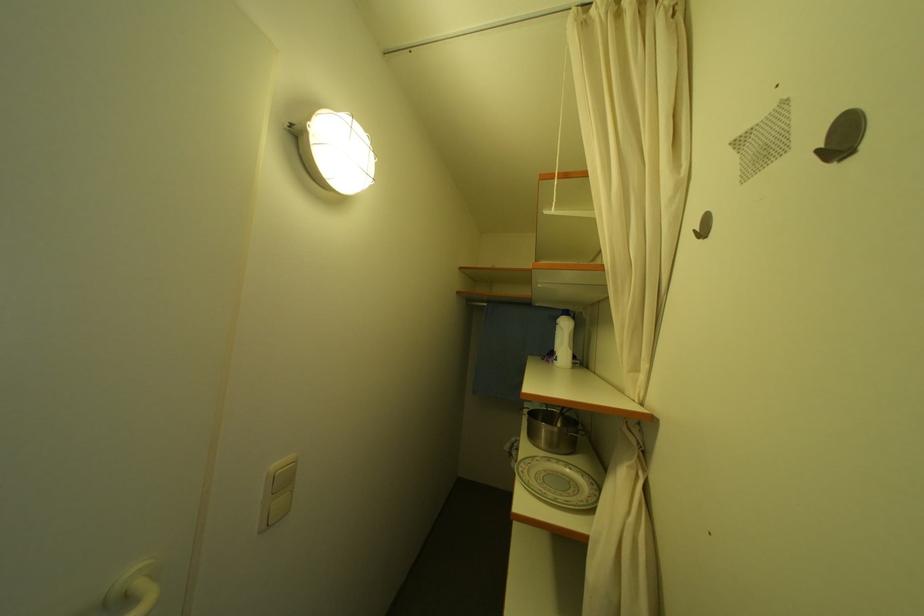
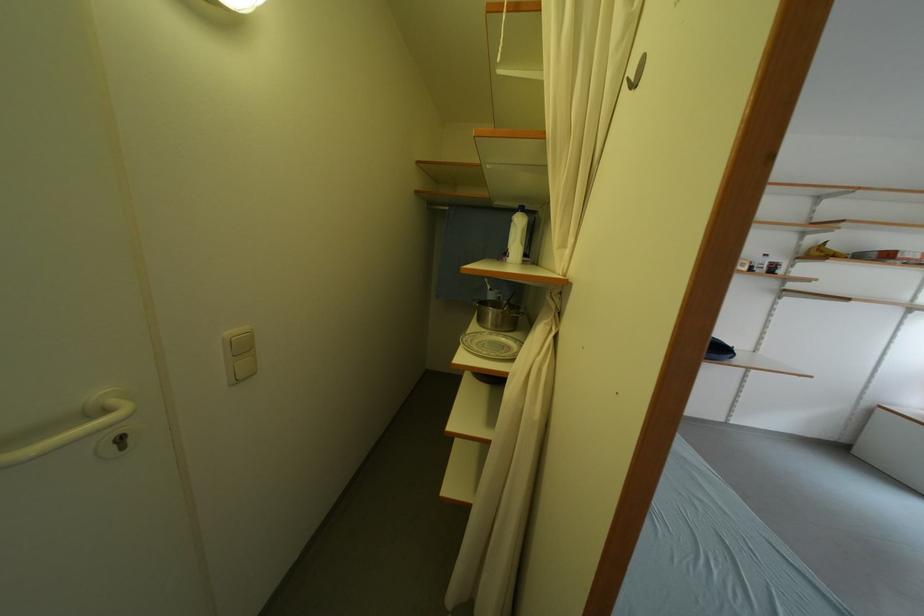
Question: The images are taken continuously from a first-person perspective. In which direction is your viewpoint rotating?

Choices:
 (A) Left
 (B) Right
 (C) Up
 (D) Down

Answer: (D)